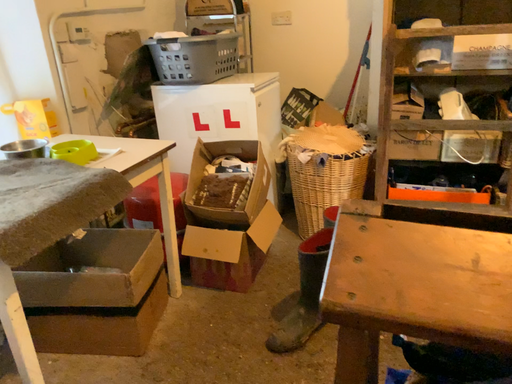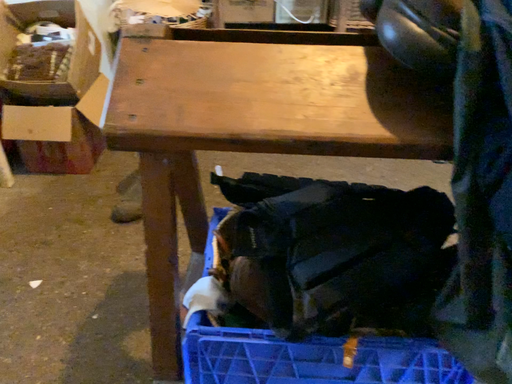
Question: How did the camera likely rotate when shooting the video?

Choices:
 (A) rotated upward
 (B) rotated downward

Answer: (B)